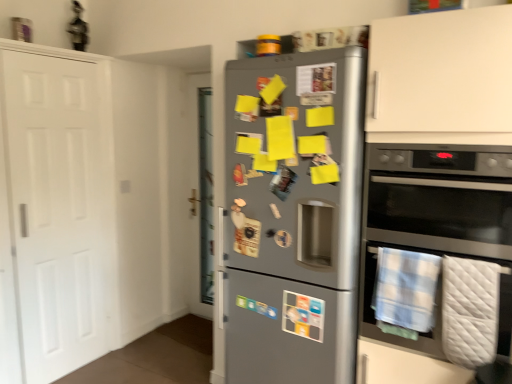
Question: Is white matte door at left not inside white quilted blanket at lower right, which ranks as the first blanket in right-to-left order?

Choices:
 (A) no
 (B) yes

Answer: (B)

Question: Is the position of white matte door at left less distant than that of white quilted blanket at lower right, which is the second blanket from left to right?

Choices:
 (A) yes
 (B) no

Answer: (B)

Question: From a real-world perspective, is white matte door at left located beneath white quilted blanket at lower right, which ranks as the first blanket in right-to-left order?

Choices:
 (A) no
 (B) yes

Answer: (A)

Question: Would you say white matte door at left is a long distance from white quilted blanket at lower right, which is the second blanket from left to right?

Choices:
 (A) no
 (B) yes

Answer: (B)

Question: From a real-world perspective, is white matte door at left physically above white quilted blanket at lower right, which is the second blanket from left to right?

Choices:
 (A) no
 (B) yes

Answer: (B)

Question: Is satin silver fridge at center inside the boundaries of stainless steel oven at right, or outside?

Choices:
 (A) outside
 (B) inside

Answer: (A)

Question: Considering the positions of point [249, 314] and point [412, 157], is point [249, 314] closer or farther from the camera than point [412, 157]?

Choices:
 (A) closer
 (B) farther

Answer: (B)

Question: In terms of size, does satin silver fridge at center appear bigger or smaller than stainless steel oven at right?

Choices:
 (A) small
 (B) big

Answer: (B)

Question: In the image, is satin silver fridge at center positioned in front of or behind stainless steel oven at right?

Choices:
 (A) front
 (B) behind

Answer: (B)

Question: From the image's perspective, is satin silver fridge at center above or below white matte door at left?

Choices:
 (A) below
 (B) above

Answer: (A)

Question: Do you think satin silver fridge at center is within white matte door at left, or outside of it?

Choices:
 (A) outside
 (B) inside

Answer: (A)

Question: From a real-world perspective, is satin silver fridge at center above or below white matte door at left?

Choices:
 (A) above
 (B) below

Answer: (B)

Question: Is point (346, 331) positioned closer to the camera than point (55, 326)?

Choices:
 (A) farther
 (B) closer

Answer: (B)

Question: From the image's perspective, is blue plaid towel at lower right, which is counted as the first blanket, starting from the left, above or below white quilted blanket at lower right, which is the second blanket from left to right?

Choices:
 (A) below
 (B) above

Answer: (B)

Question: Is blue plaid towel at lower right, which is counted as the second blanket, starting from the right, in front of or behind white quilted blanket at lower right, which ranks as the first blanket in right-to-left order, in the image?

Choices:
 (A) behind
 (B) front

Answer: (A)